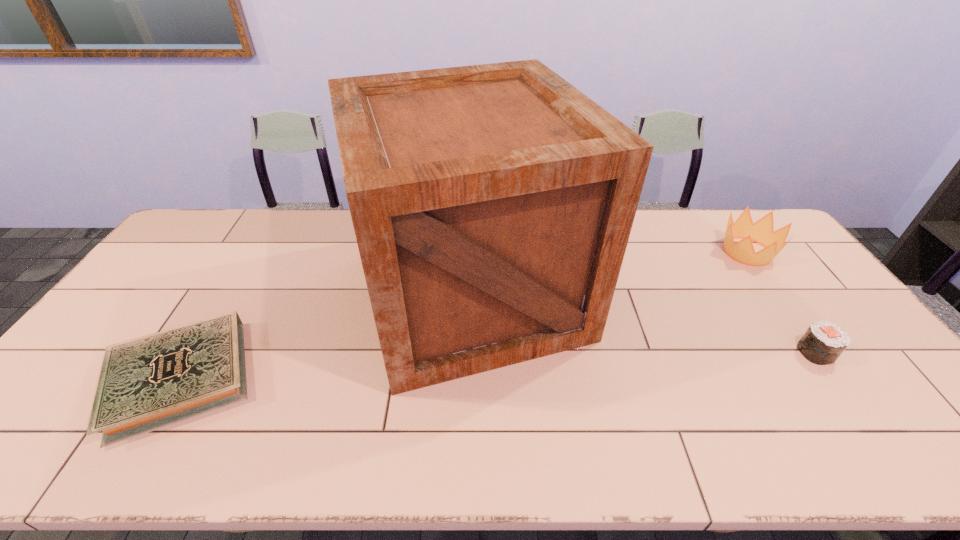
You are a GUI agent. You are given a task and a screenshot of the screen. Output one action in this format:
    pyautogui.click(x=<x>, y=<y>)
    Task: Click on the vacant point at the left edge
    
    Given the screenshot: What is the action you would take?
    pyautogui.click(x=166, y=299)

This screenshot has width=960, height=540. In the image, there is a desktop. Identify the location of vacant space at the right edge. (812, 306).

At what (x,y) coordinates should I click in order to perform the action: click on vacant area between the tallest object and the leftmost object. Please return your answer as a coordinate pair (x, y). This screenshot has height=540, width=960. Looking at the image, I should click on (325, 336).

The height and width of the screenshot is (540, 960). In order to click on free area in between the sushi and the third object from right to left in this screenshot , I will do `click(643, 323)`.

Where is `free space between the sushi and the second tallest object`? free space between the sushi and the second tallest object is located at coordinates (781, 302).

Locate which object is the closest to the crown. Please provide its 2D coordinates. Your answer should be formatted as a tuple, i.e. [(x, y)], where the tuple contains the x and y coordinates of a point satisfying the conditions above.

[(823, 342)]

You are a GUI agent. You are given a task and a screenshot of the screen. Output one action in this format:
    pyautogui.click(x=<x>, y=<y>)
    Task: Click on the object that stands as the closest to the tallest object
    The width and height of the screenshot is (960, 540).
    Given the screenshot: What is the action you would take?
    pyautogui.click(x=147, y=383)

The height and width of the screenshot is (540, 960). In order to click on free location that satisfies the following two spatial constraints: 1. on the back side of the box; 2. on the right side of the third shortest object in this screenshot , I will do `click(471, 252)`.

Find the location of a particular element. The width and height of the screenshot is (960, 540). blank space that satisfies the following two spatial constraints: 1. on the back side of the second tallest object; 2. on the right side of the tallest object is located at coordinates (471, 252).